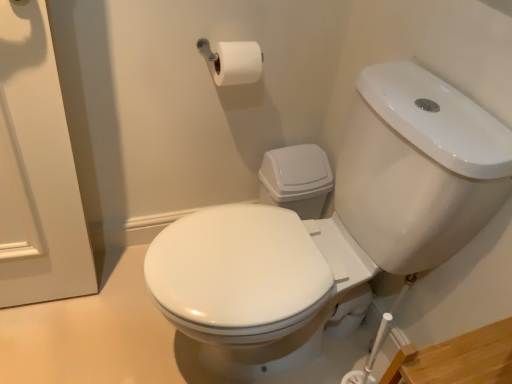
What do you see at coordinates (336, 226) in the screenshot? I see `white glossy toilet at center` at bounding box center [336, 226].

Locate an element on the screen. This screenshot has width=512, height=384. white glossy toilet at center is located at coordinates (336, 226).

In order to face white matte toilet paper at upper center, should I rotate leftwards or rightwards?

Rotate your view left by about 3.397°.

Identify the location of white matte toilet paper at upper center. This screenshot has height=384, width=512. (236, 63).

The height and width of the screenshot is (384, 512). What do you see at coordinates (236, 63) in the screenshot?
I see `white matte toilet paper at upper center` at bounding box center [236, 63].

Find the location of `white glossy toilet at center`. white glossy toilet at center is located at coordinates (336, 226).

Considering the positions of objects white glossy toilet at center and white matte toilet paper at upper center in the image provided, who is more to the right, white glossy toilet at center or white matte toilet paper at upper center?

From the viewer's perspective, white glossy toilet at center appears more on the right side.

Considering the positions of objects white glossy toilet at center and white matte toilet paper at upper center in the image provided, who is in front, white glossy toilet at center or white matte toilet paper at upper center?

white glossy toilet at center.

Does point (296, 296) appear closer or farther from the camera than point (228, 43)?

Point (296, 296).

From the image's perspective, which is below, white glossy toilet at center or white matte toilet paper at upper center?

white glossy toilet at center.

From a real-world perspective, does white glossy toilet at center stand above white matte toilet paper at upper center?

No, from a real-world perspective, white glossy toilet at center is not on top of white matte toilet paper at upper center.

Considering the sizes of objects white glossy toilet at center and white matte toilet paper at upper center in the image provided, who is wider, white glossy toilet at center or white matte toilet paper at upper center?

white glossy toilet at center is wider.

In the scene shown: Can you confirm if white glossy toilet at center is taller than white matte toilet paper at upper center?

Yes.

Who is bigger, white glossy toilet at center or white matte toilet paper at upper center?

white glossy toilet at center is bigger.

Is white glossy toilet at center positioned beyond the bounds of white matte toilet paper at upper center?

Yes.

Is there a large distance between white glossy toilet at center and white matte toilet paper at upper center?

No, white glossy toilet at center is in close proximity to white matte toilet paper at upper center.

Is white glossy toilet at center positioned with its back to white matte toilet paper at upper center?

That's not correct — white glossy toilet at center is not looking away from white matte toilet paper at upper center.

How many degrees apart are the facing directions of white glossy toilet at center and white matte toilet paper at upper center?

The angle between the facing direction of white glossy toilet at center and the facing direction of white matte toilet paper at upper center is 89.9 degrees.

At what (x,y) coordinates should I click in order to perform the action: click on toilet paper that appears above the white glossy toilet at center (from the image's perspective). Please return your answer as a coordinate pair (x, y). This screenshot has height=384, width=512. Looking at the image, I should click on (236, 63).

Consider the image. Can you confirm if white matte toilet paper at upper center is positioned to the left of white glossy toilet at center?

Correct, you'll find white matte toilet paper at upper center to the left of white glossy toilet at center.

Is white matte toilet paper at upper center in front of or behind white glossy toilet at center in the image?

Visually, white matte toilet paper at upper center is located behind white glossy toilet at center.

Which is closer to the camera, (212, 64) or (296, 268)?

Positioned in front is point (296, 268).

From the image's perspective, is white matte toilet paper at upper center above white glossy toilet at center?

Yes.

From a real-world perspective, is white matte toilet paper at upper center under white glossy toilet at center?

No, from a real-world perspective, white matte toilet paper at upper center is not under white glossy toilet at center.

Is white matte toilet paper at upper center wider or thinner than white glossy toilet at center?

Clearly, white matte toilet paper at upper center has less width compared to white glossy toilet at center.

Between white matte toilet paper at upper center and white glossy toilet at center, which one has less height?

With less height is white matte toilet paper at upper center.

Is white matte toilet paper at upper center smaller than white glossy toilet at center?

Indeed, white matte toilet paper at upper center has a smaller size compared to white glossy toilet at center.

From the picture: Is white matte toilet paper at upper center spatially inside white glossy toilet at center, or outside of it?

white matte toilet paper at upper center is spatially situated outside white glossy toilet at center.

Are white matte toilet paper at upper center and white glossy toilet at center located far from each other?

No, there isn't a large distance between white matte toilet paper at upper center and white glossy toilet at center.

Is white matte toilet paper at upper center oriented away from white glossy toilet at center?

No, white glossy toilet at center is not at the back of white matte toilet paper at upper center.

How much distance is there between white matte toilet paper at upper center and white glossy toilet at center?

white matte toilet paper at upper center and white glossy toilet at center are 19.45 inches apart.

Locate an element on the screen. The width and height of the screenshot is (512, 384). toilet paper above the white glossy toilet at center (from a real-world perspective) is located at coordinates (236, 63).

The image size is (512, 384). Identify the location of toilet paper above the white glossy toilet at center (from the image's perspective). (236, 63).

Where is `toilet paper above the white glossy toilet at center (from a real-world perspective)`? The image size is (512, 384). toilet paper above the white glossy toilet at center (from a real-world perspective) is located at coordinates (236, 63).